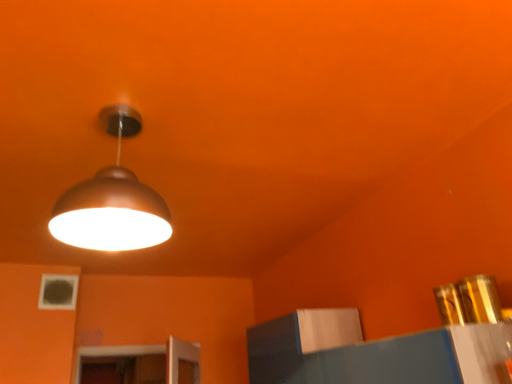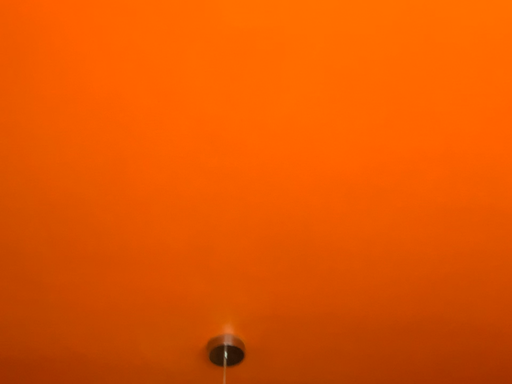
Question: Which way did the camera rotate in the video?

Choices:
 (A) rotated upward
 (B) rotated downward

Answer: (A)